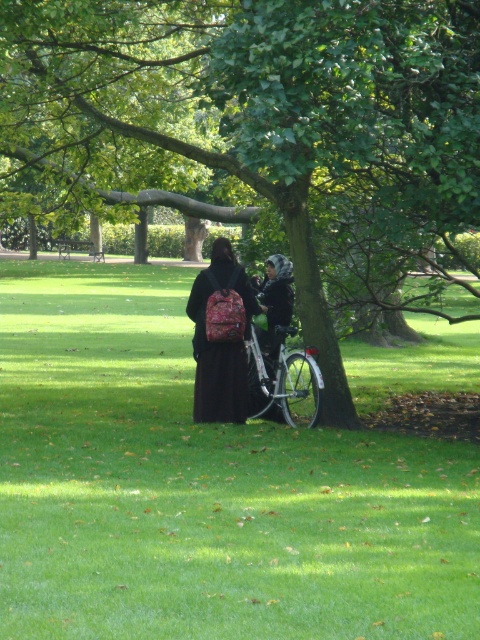
You are a photographer trying to capture the green grass at center and the matte pink backpack at center in the same frame. Based on their positions, which object should you focus on first to ensure both are in focus?

The green grass at center is in front of the matte pink backpack at center, so you should focus on the green grass at center first to ensure both are in focus.

You are a gardener planning to plant flowers between the green grass at center and the green leafy tree at center. Based on their positions, where should you place the flowers?

The green grass at center is below the green leafy tree at center, so you should plant the flowers on the ground near the green grass at center to ensure they receive adequate sunlight and avoid being overshadowed by the tree.